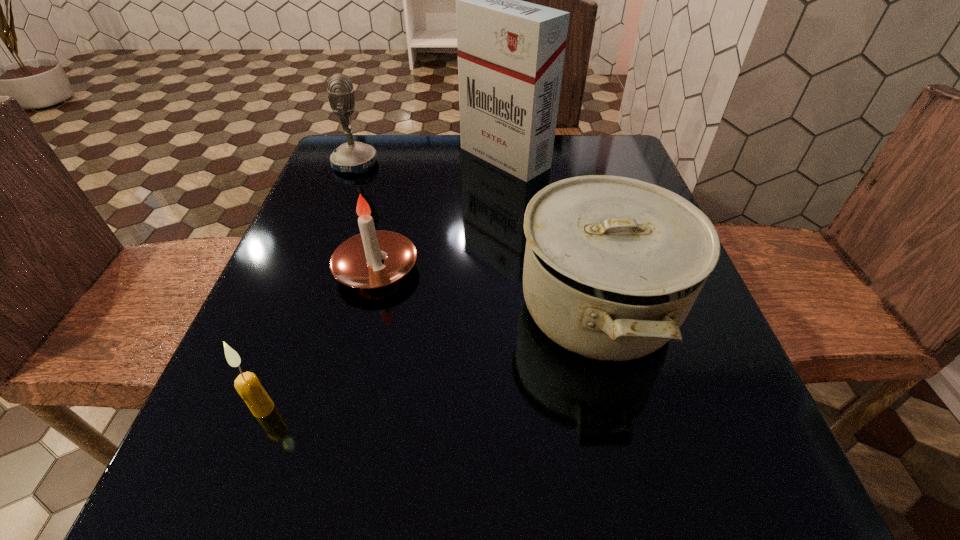
Where is `vacant space at the far right corner of the desktop`? The width and height of the screenshot is (960, 540). vacant space at the far right corner of the desktop is located at coordinates (579, 158).

Locate an element on the screen. free location at the near right corner of the desktop is located at coordinates (760, 467).

Locate an element on the screen. Image resolution: width=960 pixels, height=540 pixels. free spot between the left candle and the saucepan is located at coordinates (430, 357).

This screenshot has height=540, width=960. Find the location of `blank region between the left candle and the microphone`. blank region between the left candle and the microphone is located at coordinates (309, 286).

Locate an element on the screen. vacant area that lies between the saucepan and the microphone is located at coordinates (476, 235).

Identify the location of free space that is in between the saucepan and the nearer candle. (x=430, y=357).

Identify the location of empty space between the microphone and the saucepan. The height and width of the screenshot is (540, 960). (476, 235).

This screenshot has width=960, height=540. I want to click on free spot between the left candle and the microphone, so click(309, 286).

The width and height of the screenshot is (960, 540). I want to click on free space that is in between the farther candle and the saucepan, so point(487,288).

Find the location of a particular element. The height and width of the screenshot is (540, 960). free space between the farther candle and the cigarette case is located at coordinates point(441,213).